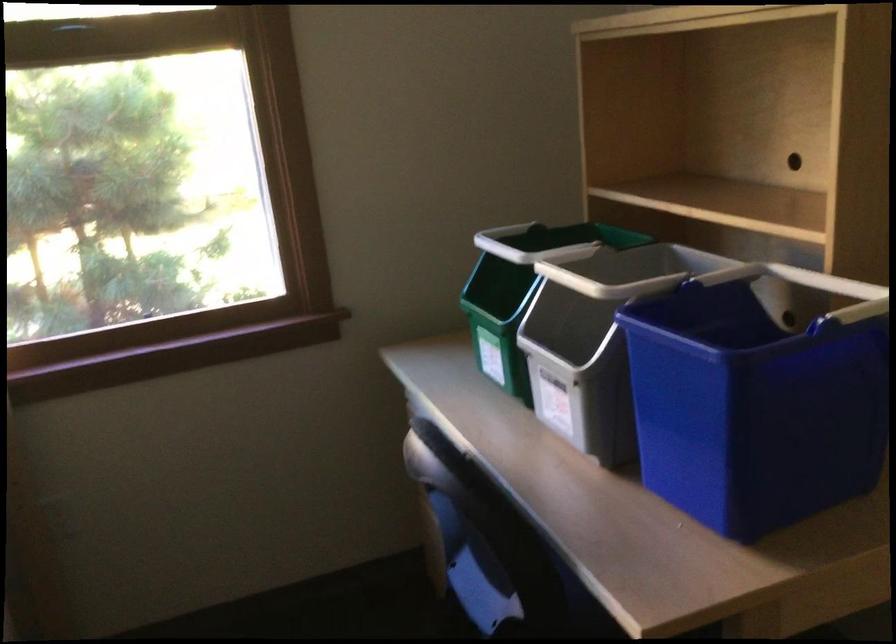
I want to click on grey bin handle, so click(x=483, y=541).